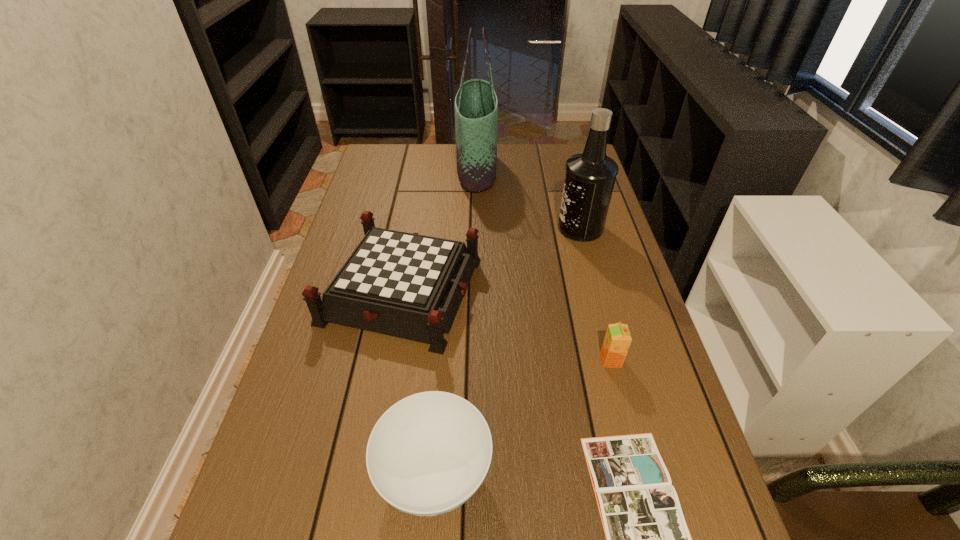
You are a GUI agent. You are given a task and a screenshot of the screen. Output one action in this format:
    pyautogui.click(x=<x>, y=<y>)
    Task: Click on the farthest object
    The image size is (960, 540).
    Given the screenshot: What is the action you would take?
    pyautogui.click(x=476, y=105)

Image resolution: width=960 pixels, height=540 pixels. In order to click on the tallest object in this screenshot , I will do `click(476, 105)`.

The image size is (960, 540). Identify the location of liquor. (590, 176).

Image resolution: width=960 pixels, height=540 pixels. I want to click on checkerboard, so click(402, 284).

The width and height of the screenshot is (960, 540). I want to click on orange juice, so click(617, 340).

Find the location of a particular element. Image resolution: width=960 pixels, height=540 pixels. chinaware is located at coordinates (428, 454).

What are the coordinates of `vacant space located on the right of the tote bag` in the screenshot? It's located at (549, 169).

Find the location of a particular element. The image size is (960, 540). vacant space positioned on the front label of the fifth shortest object is located at coordinates (517, 228).

You are a GUI agent. You are given a task and a screenshot of the screen. Output one action in this format:
    pyautogui.click(x=<x>, y=<y>)
    Task: Click on the vacant space located 0.330m on the front label of the fifth shortest object
    The height and width of the screenshot is (540, 960).
    Given the screenshot: What is the action you would take?
    pyautogui.click(x=448, y=228)

Where is `free space located on the front label of the fifth shortest object`? free space located on the front label of the fifth shortest object is located at coordinates (534, 228).